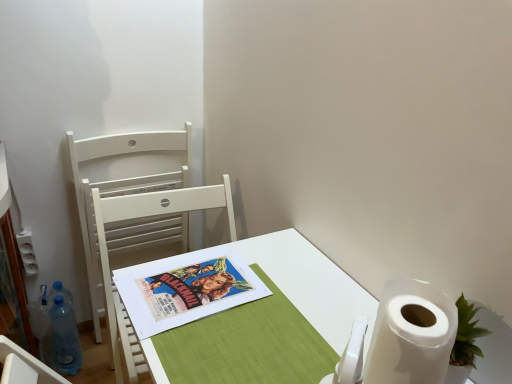
Question: Does colorful paper poster at center have a smaller size compared to white wood chair at left, which ranks as the second chair in front-to-back order?

Choices:
 (A) no
 (B) yes

Answer: (B)

Question: Considering the relative positions of colorful paper poster at center and white wood chair at left, which is the 1th chair in back-to-front order, in the image provided, is colorful paper poster at center in front of white wood chair at left, which is the 1th chair in back-to-front order,?

Choices:
 (A) no
 (B) yes

Answer: (B)

Question: Is colorful paper poster at center aimed at white wood chair at left, which is the 1th chair in back-to-front order?

Choices:
 (A) yes
 (B) no

Answer: (B)

Question: Is white wood chair at left, which ranks as the second chair in front-to-back order, surrounded by colorful paper poster at center?

Choices:
 (A) yes
 (B) no

Answer: (B)

Question: Is colorful paper poster at center in contact with white wood chair at left, which ranks as the second chair in front-to-back order?

Choices:
 (A) no
 (B) yes

Answer: (A)

Question: In terms of height, does blue translucent bottle at lower left look taller or shorter compared to colorful paper poster at center?

Choices:
 (A) tall
 (B) short

Answer: (A)

Question: Is point (69, 307) positioned closer to the camera than point (219, 302)?

Choices:
 (A) farther
 (B) closer

Answer: (A)

Question: In terms of width, does blue translucent bottle at lower left look wider or thinner when compared to colorful paper poster at center?

Choices:
 (A) wide
 (B) thin

Answer: (B)

Question: From a real-world perspective, relative to colorful paper poster at center, is blue translucent bottle at lower left vertically above or below?

Choices:
 (A) above
 (B) below

Answer: (B)

Question: Which is correct: colorful paper poster at center is inside white wood chair at left, the 1th chair when ordered from front to back, or outside of it?

Choices:
 (A) outside
 (B) inside

Answer: (B)

Question: In terms of height, does colorful paper poster at center look taller or shorter compared to white wood chair at left, the 1th chair when ordered from front to back?

Choices:
 (A) short
 (B) tall

Answer: (A)

Question: Is point (208, 271) positioned closer to the camera than point (219, 185)?

Choices:
 (A) closer
 (B) farther

Answer: (A)

Question: Relative to white wood chair at left, the 2th chair positioned from the back, is colorful paper poster at center in front or behind?

Choices:
 (A) front
 (B) behind

Answer: (A)

Question: From a real-world perspective, is white wood chair at left, which is the 1th chair in back-to-front order, positioned above or below white plastic power outlet at left?

Choices:
 (A) below
 (B) above

Answer: (A)

Question: Considering the positions of white wood chair at left, which ranks as the second chair in front-to-back order, and white plastic power outlet at left in the image, is white wood chair at left, which ranks as the second chair in front-to-back order, taller or shorter than white plastic power outlet at left?

Choices:
 (A) short
 (B) tall

Answer: (B)